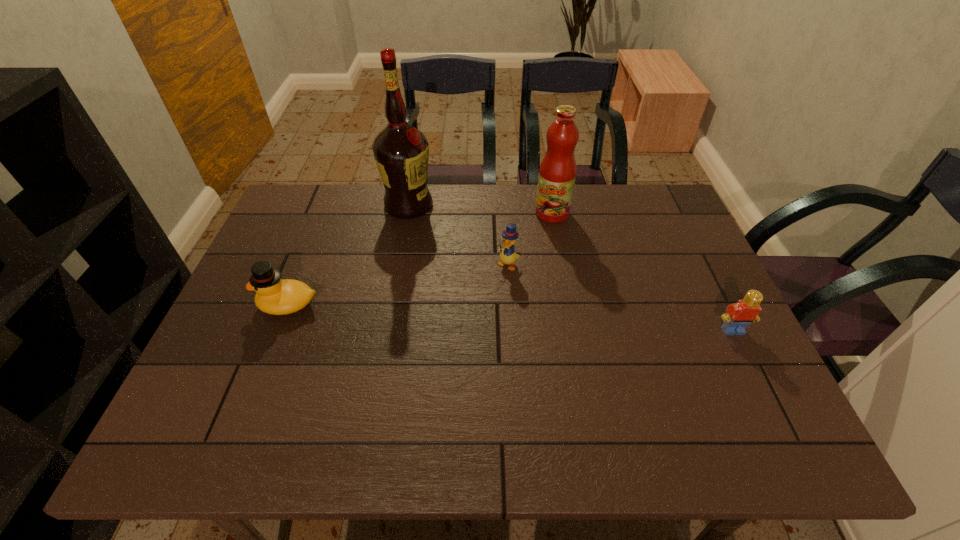
Locate an element on the screen. vacant area that lies between the fruit juice and the leftmost object is located at coordinates (420, 259).

Locate an element on the screen. free space between the third farthest object and the fruit juice is located at coordinates (530, 239).

Where is `free space between the duckling and the fourth object from left to right`? free space between the duckling and the fourth object from left to right is located at coordinates (530, 239).

Locate an element on the screen. The height and width of the screenshot is (540, 960). free point between the tallest object and the third nearest object is located at coordinates (458, 235).

Identify the location of free space between the nearest object and the third object from right to left. (620, 298).

I want to click on free space between the Lego and the third nearest object, so click(x=620, y=298).

Identify the location of vacant region between the duckling and the Lego. Image resolution: width=960 pixels, height=540 pixels. (620, 298).

Image resolution: width=960 pixels, height=540 pixels. Identify the location of free spot between the leftmost object and the second tallest object. (420, 259).

At what (x,y) coordinates should I click in order to perform the action: click on free spot between the nearest object and the alcohol. Please return your answer as a coordinate pair (x, y). The width and height of the screenshot is (960, 540). Looking at the image, I should click on (570, 268).

Where is `object that is the closest to the rightmost object`? object that is the closest to the rightmost object is located at coordinates (557, 173).